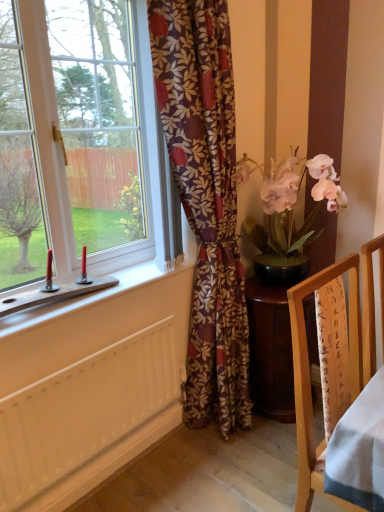
Question: Does wooden frame at right have a greater height compared to floral-patterned fabric at center?

Choices:
 (A) yes
 (B) no

Answer: (B)

Question: From the image's perspective, is wooden frame at right on top of floral-patterned fabric at center?

Choices:
 (A) no
 (B) yes

Answer: (A)

Question: Is wooden frame at right facing away from floral-patterned fabric at center?

Choices:
 (A) yes
 (B) no

Answer: (A)

Question: Considering the relative sizes of wooden frame at right and floral-patterned fabric at center in the image provided, is wooden frame at right smaller than floral-patterned fabric at center?

Choices:
 (A) yes
 (B) no

Answer: (A)

Question: Is wooden frame at right completely or partially outside of floral-patterned fabric at center?

Choices:
 (A) yes
 (B) no

Answer: (A)

Question: Does point (246, 398) appear closer or farther from the camera than point (253, 238)?

Choices:
 (A) farther
 (B) closer

Answer: (B)

Question: Considering the positions of floral-patterned fabric at center and pink silk orchid at right in the image, is floral-patterned fabric at center bigger or smaller than pink silk orchid at right?

Choices:
 (A) big
 (B) small

Answer: (A)

Question: Relative to pink silk orchid at right, is floral-patterned fabric at center in front or behind?

Choices:
 (A) front
 (B) behind

Answer: (A)

Question: Choose the correct answer: Is floral-patterned fabric at center inside pink silk orchid at right or outside it?

Choices:
 (A) inside
 (B) outside

Answer: (B)

Question: In terms of width, does floral-patterned fabric at center look wider or thinner when compared to white painted wood radiator at lower left?

Choices:
 (A) wide
 (B) thin

Answer: (A)

Question: Looking at the image, does floral-patterned fabric at center seem bigger or smaller compared to white painted wood radiator at lower left?

Choices:
 (A) big
 (B) small

Answer: (A)

Question: Which is correct: floral-patterned fabric at center is inside white painted wood radiator at lower left, or outside of it?

Choices:
 (A) inside
 (B) outside

Answer: (B)

Question: Considering the relative positions of floral-patterned fabric at center and white painted wood radiator at lower left in the image provided, is floral-patterned fabric at center to the left or to the right of white painted wood radiator at lower left?

Choices:
 (A) left
 (B) right

Answer: (B)

Question: From their relative heights in the image, would you say white painted wood radiator at lower left is taller or shorter than white plastic window at left?

Choices:
 (A) short
 (B) tall

Answer: (A)

Question: Considering the positions of white painted wood radiator at lower left and white plastic window at left in the image, is white painted wood radiator at lower left bigger or smaller than white plastic window at left?

Choices:
 (A) big
 (B) small

Answer: (B)